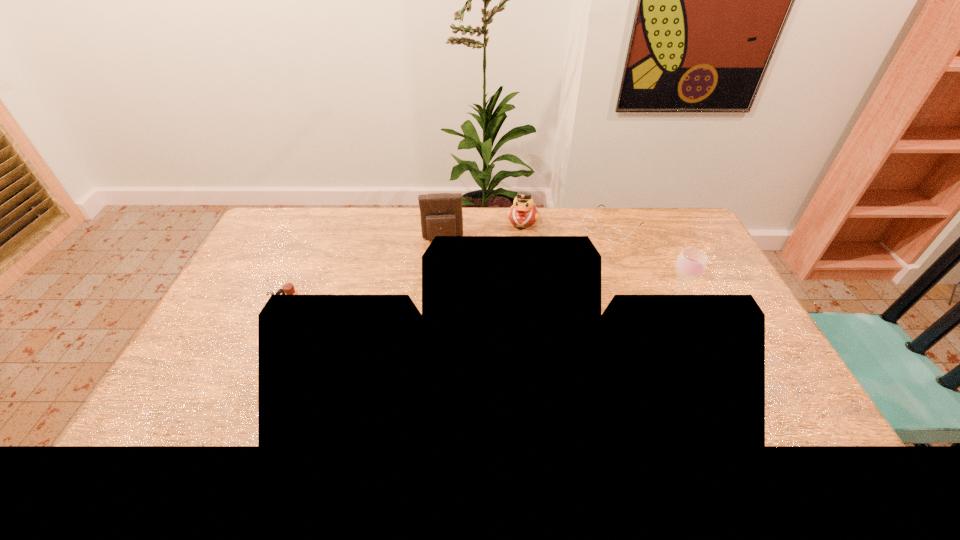
You are a GUI agent. You are given a task and a screenshot of the screen. Output one action in this format:
    pyautogui.click(x=<x>, y=<y>)
    Task: Click on the spectacles present at the far edge
    
    Given the screenshot: What is the action you would take?
    pyautogui.click(x=614, y=235)

Find the location of a particular element. This screenshot has height=540, width=960. object at the right edge is located at coordinates (691, 263).

Identify the location of vacant space at the far edge of the desktop. The height and width of the screenshot is (540, 960). (387, 234).

This screenshot has height=540, width=960. In the image, there is a desktop. Find the location of `vacant space at the near edge`. vacant space at the near edge is located at coordinates (354, 400).

At what (x,y) coordinates should I click in order to perform the action: click on free region at the left edge. Please return your answer as a coordinate pair (x, y). Looking at the image, I should click on (276, 274).

In the image, there is a desktop. Where is `blank space at the right edge`? blank space at the right edge is located at coordinates (688, 301).

You are a GUI agent. You are given a task and a screenshot of the screen. Output one action in this format:
    pyautogui.click(x=<x>, y=<y>)
    Task: Click on the vacant space at the far right corner of the desktop
    
    Given the screenshot: What is the action you would take?
    pyautogui.click(x=655, y=218)

You are a GUI agent. You are given a task and a screenshot of the screen. Output one action in this format:
    pyautogui.click(x=<x>, y=<y>)
    Task: Click on the free space between the third object from right to left and the Lego
    
    Given the screenshot: What is the action you would take?
    tap(407, 265)

Identify the location of vacant area that lies between the duck and the wineglass. (598, 262).

This screenshot has height=540, width=960. I want to click on vacant point located between the duck and the leftmost object, so click(407, 265).